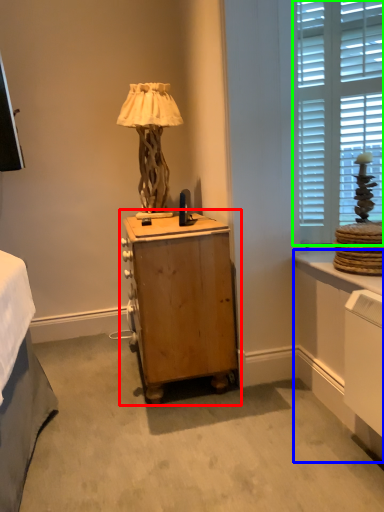
Question: Which is farther away from nightstand (highlighted by a red box)? vanity (highlighted by a blue box) or window (highlighted by a green box)?

Choices:
 (A) vanity
 (B) window

Answer: (B)